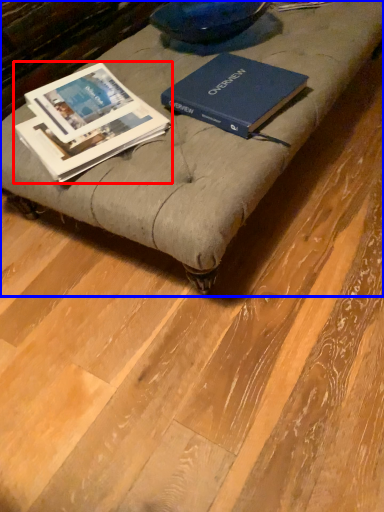
Question: Which object appears closest to the camera in this image, book (highlighted by a red box) or furniture (highlighted by a blue box)?

Choices:
 (A) book
 (B) furniture

Answer: (B)